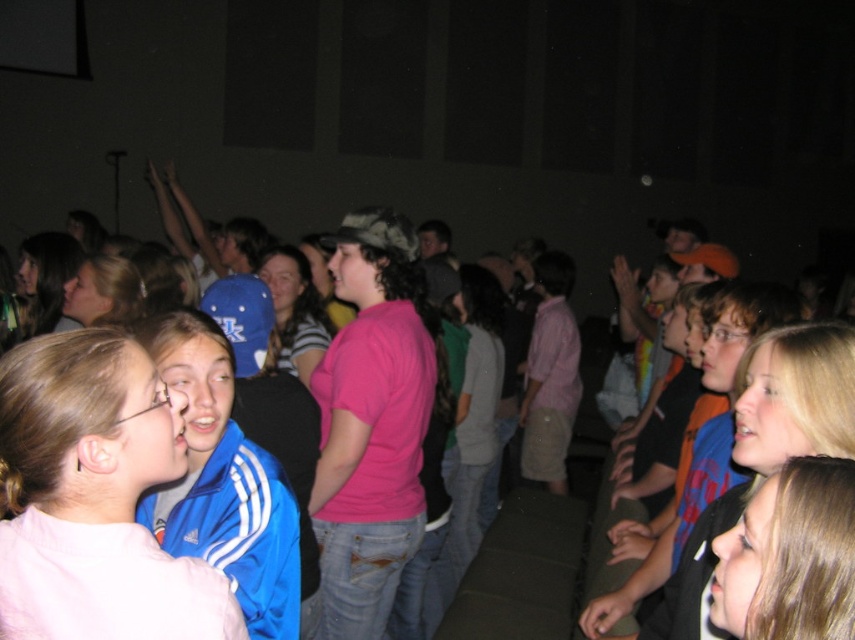
Question: Which point is closer to the camera?

Choices:
 (A) blue synthetic jacket at center
 (B) pink matte shirt at center

Answer: (B)

Question: Does pink matte shirt at center appear under blue synthetic jacket at center?

Choices:
 (A) no
 (B) yes

Answer: (A)

Question: Considering the relative positions of pink matte shirt at center and blue synthetic jacket at center in the image provided, where is pink matte shirt at center located with respect to blue synthetic jacket at center?

Choices:
 (A) above
 (B) below

Answer: (A)

Question: Can you confirm if pink matte shirt at center is positioned to the right of blue synthetic jacket at center?

Choices:
 (A) yes
 (B) no

Answer: (B)

Question: Which object is closer to the camera taking this photo?

Choices:
 (A) blue synthetic jacket at center
 (B) pink matte shirt at center

Answer: (B)